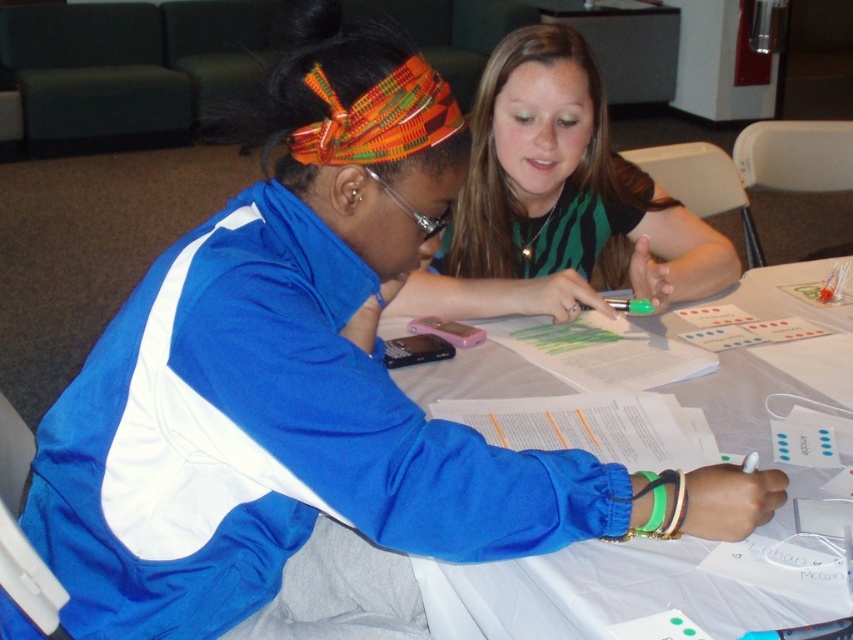
Question: Which object is closer to the camera taking this photo?

Choices:
 (A) green striped shirt at upper center
 (B) white paper at center

Answer: (B)

Question: Does green striped shirt at upper center have a greater width compared to white paper at center?

Choices:
 (A) yes
 (B) no

Answer: (B)

Question: Is green striped shirt at upper center smaller than white paper at center?

Choices:
 (A) no
 (B) yes

Answer: (B)

Question: Which point appears closest to the camera in this image?

Choices:
 (A) (567, 611)
 (B) (555, 52)

Answer: (A)

Question: Considering the relative positions of green striped shirt at upper center and white paper at center in the image provided, where is green striped shirt at upper center located with respect to white paper at center?

Choices:
 (A) above
 (B) below

Answer: (A)